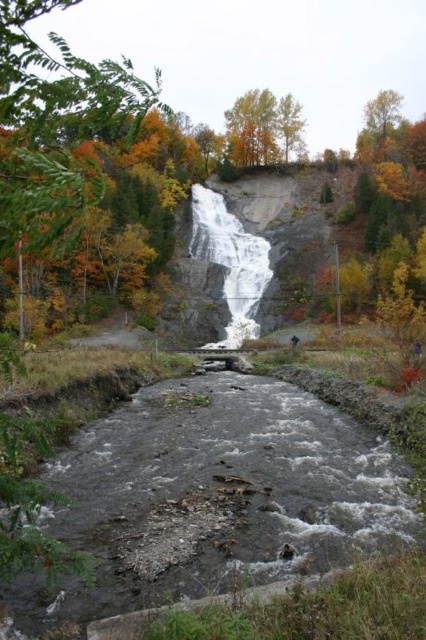
Is gray rocky stream at center to the right of gray rock waterfall at center from the viewer's perspective?

Incorrect, gray rocky stream at center is not on the right side of gray rock waterfall at center.

Which is in front, point (362, 490) or point (226, 288)?

Positioned in front is point (362, 490).

Identify the location of gray rocky stream at center. (215, 496).

Can you confirm if gray rock waterfall at center is smaller than yellow-green leaves at upper center?

Actually, gray rock waterfall at center might be larger than yellow-green leaves at upper center.

Locate an element on the screen. This screenshot has height=640, width=426. gray rock waterfall at center is located at coordinates (230, 262).

I want to click on gray rock waterfall at center, so click(230, 262).

Between gray rocky stream at center and yellow-green leaves at upper center, which one is positioned higher?

yellow-green leaves at upper center is above.

The width and height of the screenshot is (426, 640). In order to click on gray rocky stream at center in this screenshot , I will do `click(215, 496)`.